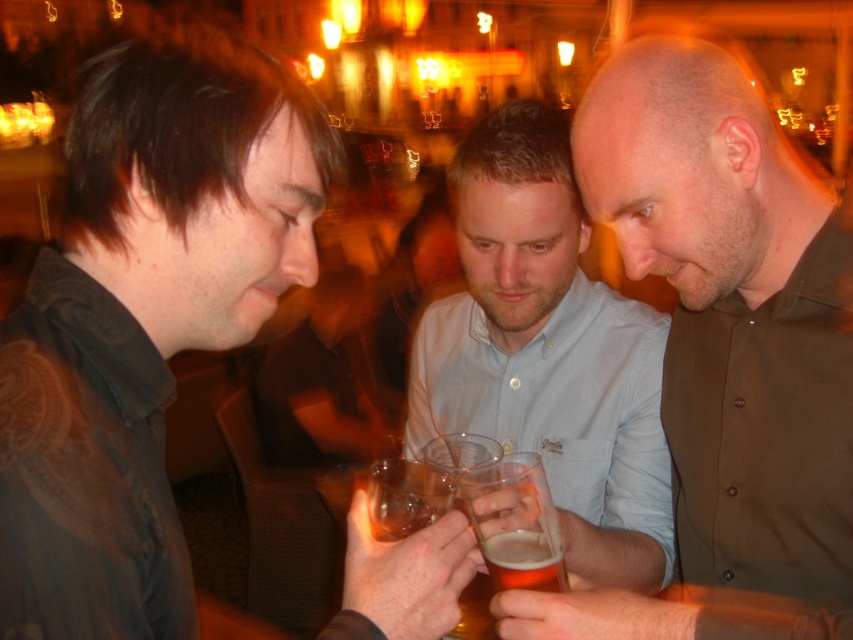
Question: Which object is farther from the camera taking this photo?

Choices:
 (A) smooth wooden table at center
 (B) light blue shirt at center
 (C) matte black shirt at left
 (D) translucent glass beer at center

Answer: (A)

Question: Which is nearer to the matte black shirt at left?

Choices:
 (A) translucent glass mug at center
 (B) light blue shirt at center
 (C) smooth wooden table at center
 (D) translucent glass beer at center

Answer: (A)

Question: Can you confirm if brown button-down shirt at center is positioned to the left of translucent glass mug at center?

Choices:
 (A) no
 (B) yes

Answer: (A)

Question: Which of the following is the farthest from the observer?

Choices:
 (A) (525, 458)
 (B) (543, 547)

Answer: (A)

Question: Is light blue shirt at center to the right of translucent glass beer at center from the viewer's perspective?

Choices:
 (A) yes
 (B) no

Answer: (A)

Question: Does light blue shirt at center appear over translucent glass mug at center?

Choices:
 (A) yes
 (B) no

Answer: (A)